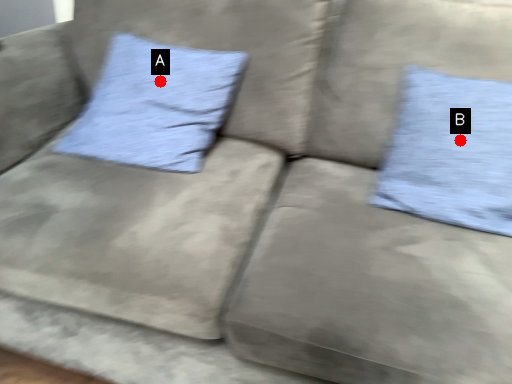
Question: Two points are circled on the image, labeled by A and B beside each circle. Which point is further to the camera?

Choices:
 (A) A is further
 (B) B is further

Answer: (A)